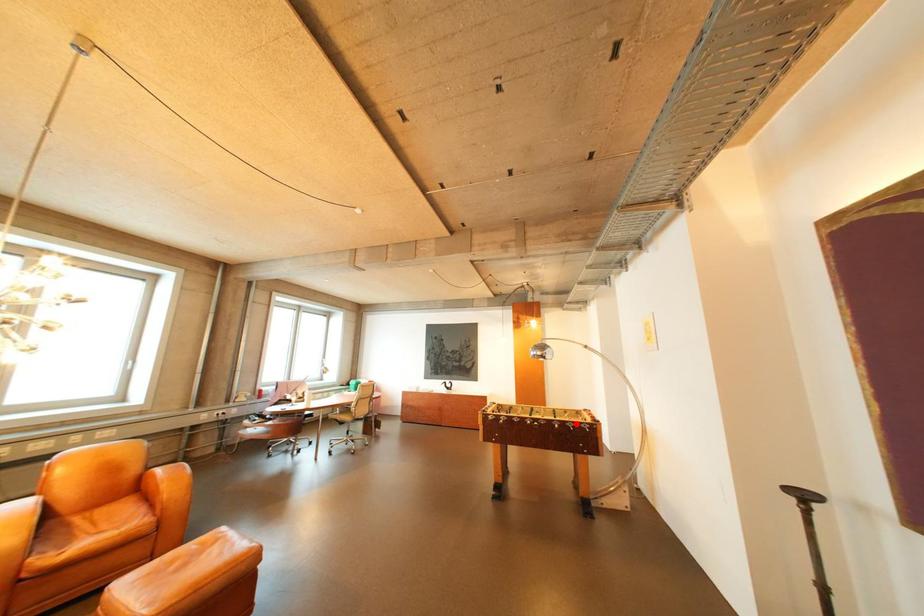
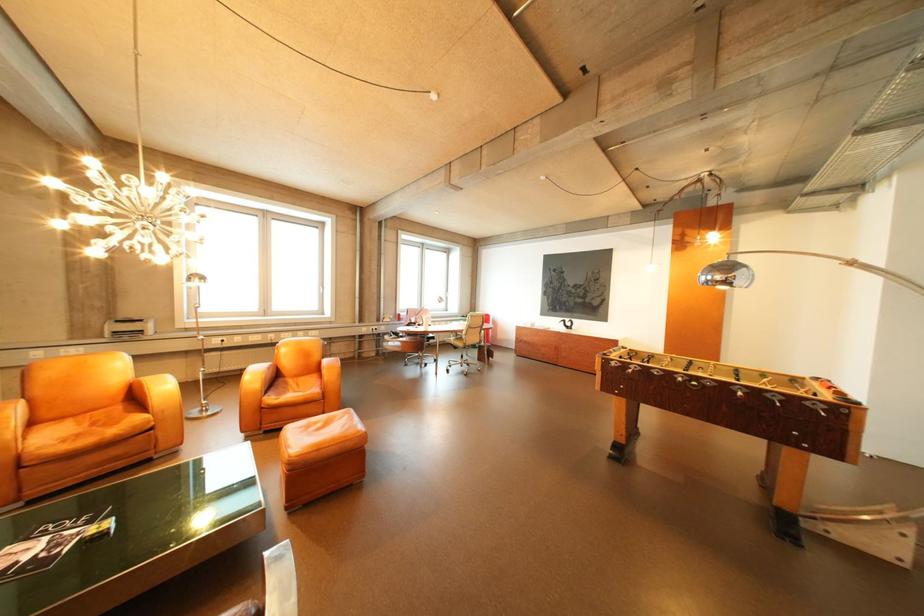
Question: I am providing you with two images of the same scene from different viewpoints. Image1 has a red point marked. In image2, the corresponding 3D location appears at what relative position? Reply with the corresponding letter.

Choices:
 (A) Closer
 (B) Farther

Answer: (B)